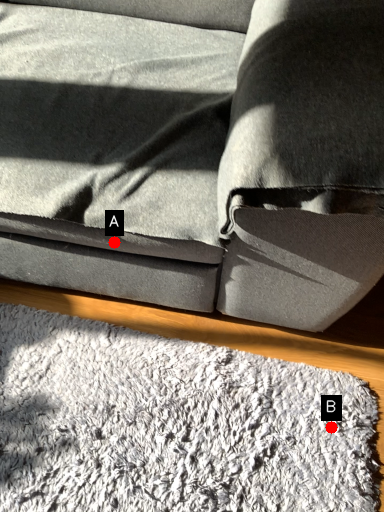
Question: Two points are circled on the image, labeled by A and B beside each circle. Which point is farther to the camera?

Choices:
 (A) A is further
 (B) B is further

Answer: (B)